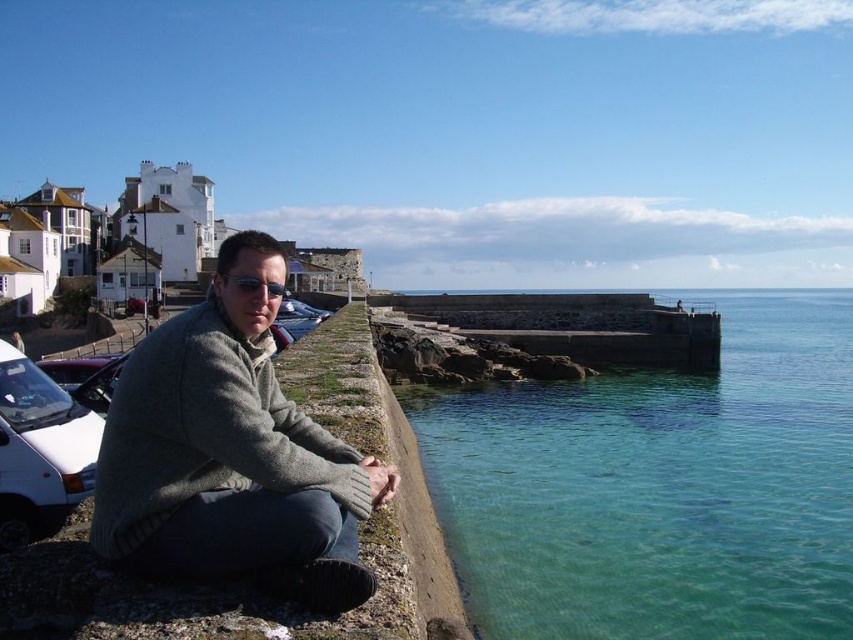
Is clear glass water at lower right smaller than gray wool sweater at center?

No, clear glass water at lower right is not smaller than gray wool sweater at center.

Is clear glass water at lower right positioned in front of gray wool sweater at center?

No, clear glass water at lower right is further to the viewer.

Where is `clear glass water at lower right`? This screenshot has width=853, height=640. clear glass water at lower right is located at coordinates (659, 486).